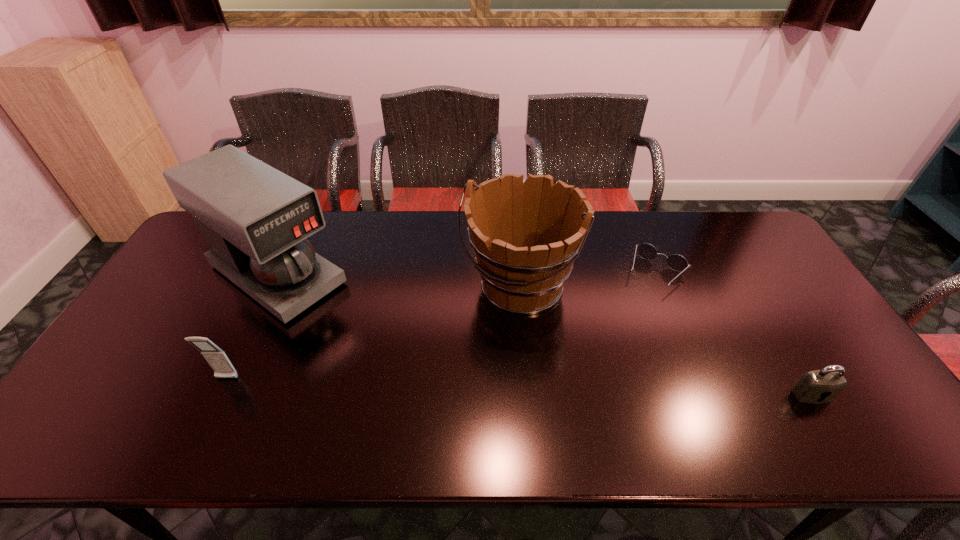
Find the location of a particular element. The image size is (960, 540). wine bucket located at the far edge is located at coordinates (526, 236).

I want to click on cellular telephone that is at the near edge, so click(x=217, y=359).

Where is `padlock present at the near edge`? This screenshot has height=540, width=960. padlock present at the near edge is located at coordinates (821, 386).

At what (x,y) coordinates should I click in order to perform the action: click on object present at the left edge. Please return your answer as a coordinate pair (x, y). Looking at the image, I should click on (255, 219).

The image size is (960, 540). What are the coordinates of `object that is at the right edge` in the screenshot? It's located at (821, 386).

In order to click on object located at the far left corner in this screenshot , I will do `click(255, 219)`.

Where is `object present at the near right corner`? The height and width of the screenshot is (540, 960). object present at the near right corner is located at coordinates (821, 386).

What are the coordinates of `blank area at the far edge` in the screenshot? It's located at (716, 254).

Find the location of a particular element. This screenshot has width=960, height=540. vacant region at the near edge of the desktop is located at coordinates (647, 391).

In the image, there is a desktop. Identify the location of vacant space at the right edge. (777, 262).